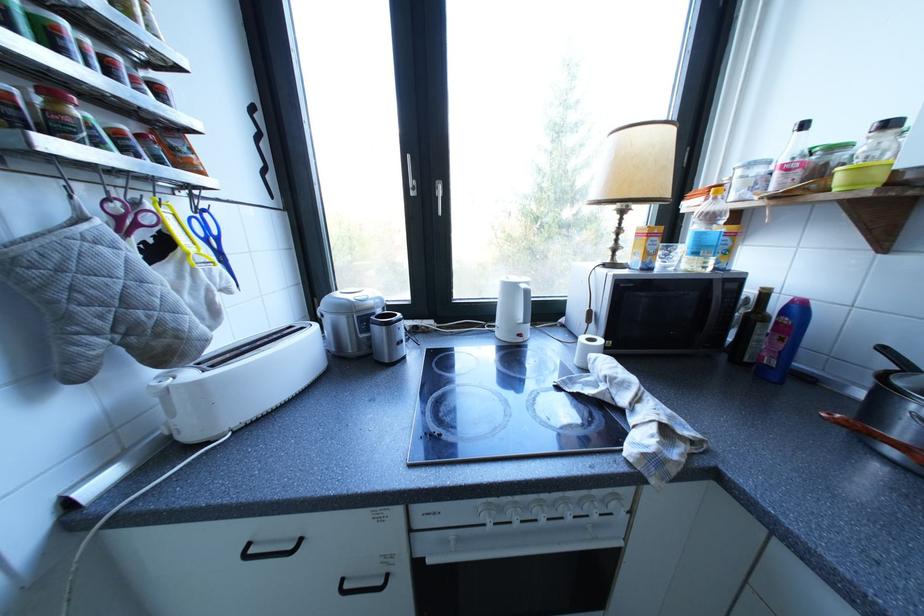
Where is `toaster lever`? toaster lever is located at coordinates (181, 392).